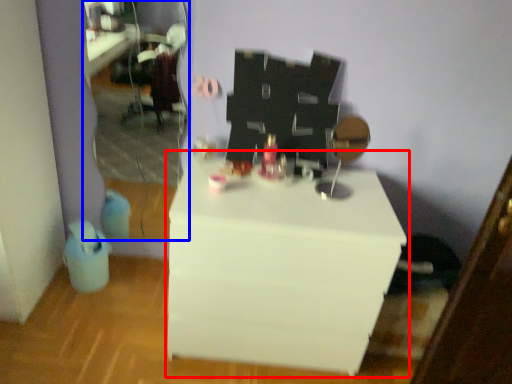
Question: Which object appears closest to the camera in this image, table (highlighted by a red box) or mirror (highlighted by a blue box)?

Choices:
 (A) table
 (B) mirror

Answer: (A)